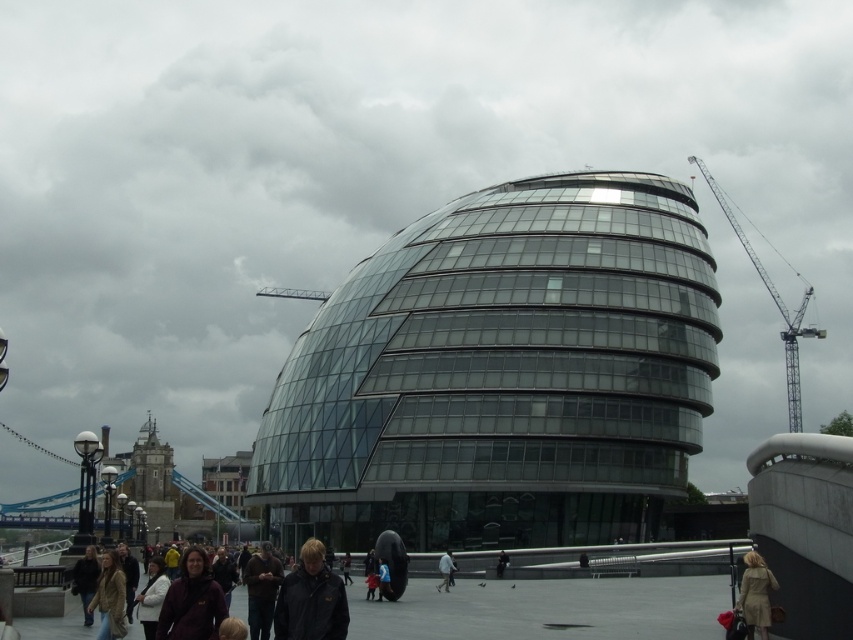
Consider the image. You are a delivery person standing at the dark gray matte jacket at lower center and need to deliver a package to the dark brown leather jacket at center. The delivery robot you use has a maximum range of 85 feet. Will the robot be able to reach the destination?

The dark gray matte jacket at lower center and dark brown leather jacket at center are 86.20 feet apart from each other. Since the robot has a maximum range of 85 feet, it will not be able to reach the destination.

You are a fashion designer observing the scene. You need to determine which jacket has a greater width between the dark gray matte jacket at lower center and the maroon fleece jacket at lower left. Which one is wider?

The dark gray matte jacket at lower center is wider than the maroon fleece jacket at lower left according to the description.